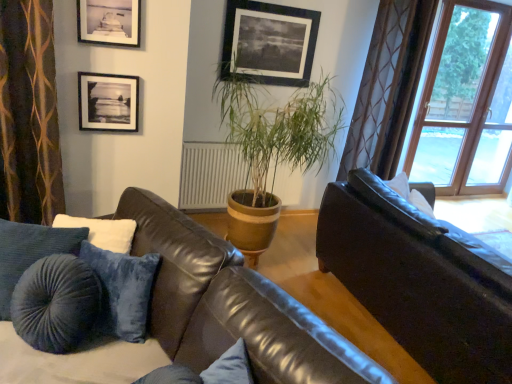
Question: Is leather couch at center, positioned as the 2th studio couch in right-to-left order, bigger than brown textured curtain at left?

Choices:
 (A) no
 (B) yes

Answer: (B)

Question: Can you confirm if leather couch at center, positioned as the 2th studio couch in right-to-left order, is smaller than brown textured curtain at left?

Choices:
 (A) no
 (B) yes

Answer: (A)

Question: Is leather couch at center, positioned as the 2th studio couch in right-to-left order, closer to the viewer compared to brown textured curtain at left?

Choices:
 (A) yes
 (B) no

Answer: (A)

Question: From a real-world perspective, does leather couch at center, the first studio couch positioned from the left, stand above brown textured curtain at left?

Choices:
 (A) no
 (B) yes

Answer: (A)

Question: Are leather couch at center, positioned as the 2th studio couch in right-to-left order, and brown textured curtain at left making contact?

Choices:
 (A) no
 (B) yes

Answer: (A)

Question: From a real-world perspective, is black matte picture frame at upper center, acting as the third picture frame starting from the left, above or below matte black picture frame at upper left, the 1th picture frame positioned from the front?

Choices:
 (A) above
 (B) below

Answer: (B)

Question: Looking at their shapes, would you say black matte picture frame at upper center, which ranks as the 1th picture frame in right-to-left order, is wider or thinner than matte black picture frame at upper left, the 2th picture frame viewed from the left?

Choices:
 (A) thin
 (B) wide

Answer: (A)

Question: From the image's perspective, is black matte picture frame at upper center, which is the third picture frame in bottom-to-top order, positioned above or below matte black picture frame at upper left, the second picture frame from the bottom?

Choices:
 (A) above
 (B) below

Answer: (A)

Question: Is point (251, 11) closer or farther from the camera than point (110, 16)?

Choices:
 (A) farther
 (B) closer

Answer: (A)

Question: Considering the positions of white soft pillow at upper right and brown textured curtain at left in the image, is white soft pillow at upper right bigger or smaller than brown textured curtain at left?

Choices:
 (A) big
 (B) small

Answer: (B)

Question: In the image, is white soft pillow at upper right positioned in front of or behind brown textured curtain at left?

Choices:
 (A) front
 (B) behind

Answer: (B)

Question: From the image's perspective, is white soft pillow at upper right located above or below brown textured curtain at left?

Choices:
 (A) below
 (B) above

Answer: (A)

Question: In terms of height, does white soft pillow at upper right look taller or shorter compared to brown textured curtain at left?

Choices:
 (A) short
 (B) tall

Answer: (A)

Question: Would you say brown textured curtain at left is to the left or to the right of leather couch at center, the first studio couch positioned from the left, in the picture?

Choices:
 (A) right
 (B) left

Answer: (B)

Question: Does point (18, 124) appear closer or farther from the camera than point (179, 211)?

Choices:
 (A) closer
 (B) farther

Answer: (B)